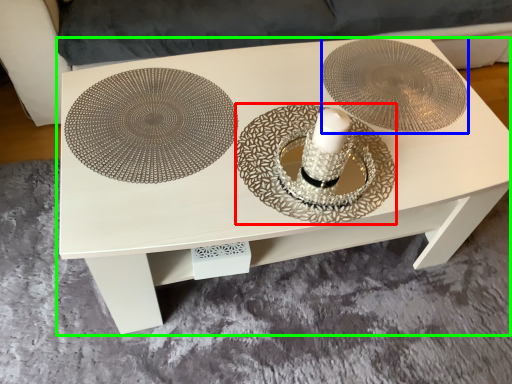
Question: Considering the real-world distances, which object is farthest from plate (highlighted by a red box)? saucer (highlighted by a blue box) or table (highlighted by a green box)?

Choices:
 (A) saucer
 (B) table

Answer: (A)